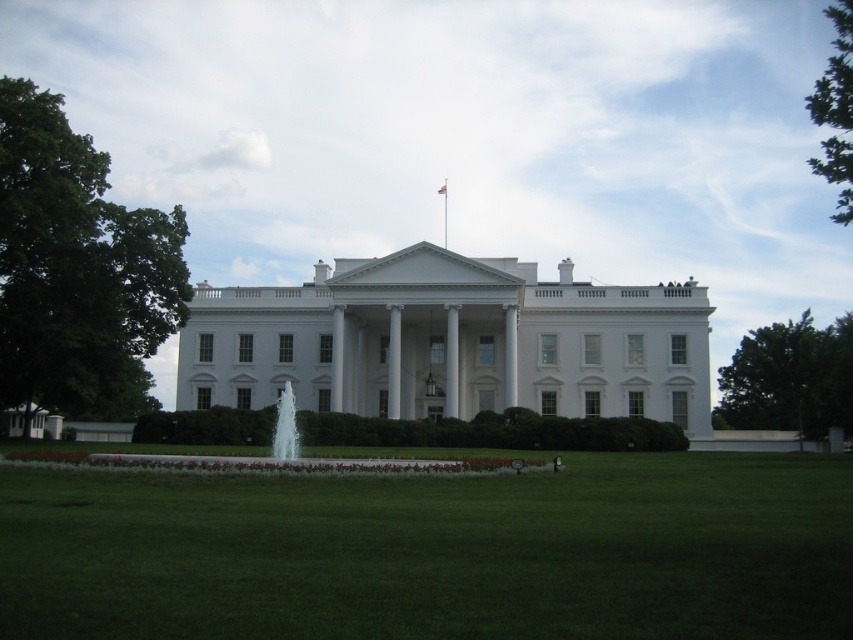
You are a photographer planning to take a picture of the green leafy tree at left and the white glossy pillar at center from the front lawn of the White House. Based on their heights, which object will appear taller in your photo?

The green leafy tree at left will appear taller in the photo since it has a greater height compared to the white glossy pillar at center.

You are a landscape architect designing a new garden. You need to place a small statue that requires a space wider than the green leafy tree at upper right. Can the green grass at lower center accommodate this statue?

The green grass at lower center might be wider than the green leafy tree at upper right, so it could potentially accommodate the statue if the statue requires a space wider than the tree.

Looking at this image, you are standing on the lawn in front of the White House and see the clear glass water at center and the white marble pillar at center. Which object is closer to the ground?

The clear glass water at center is closer to the ground since it is located below the white marble pillar at center.